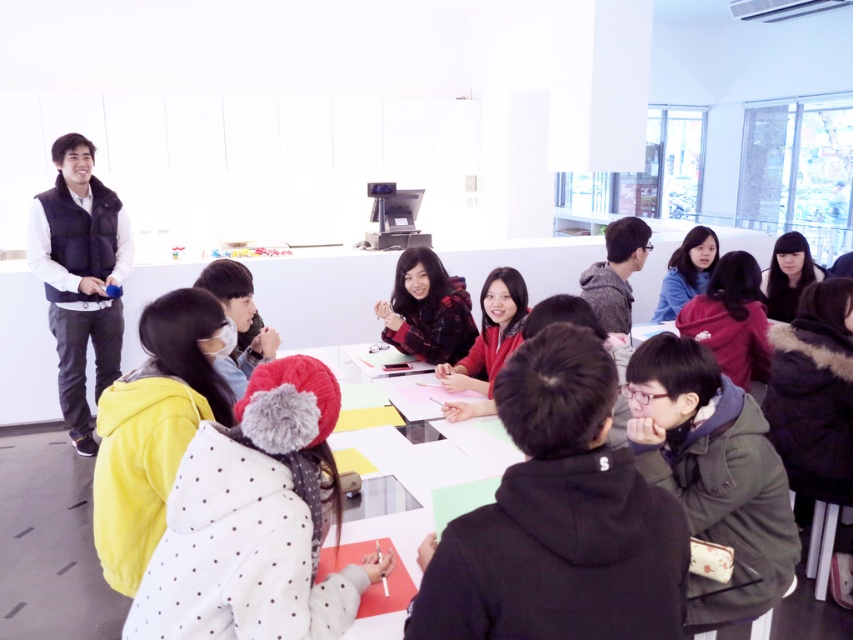
Question: Can you confirm if matte red jacket at center is smaller than black matte hair at center?

Choices:
 (A) yes
 (B) no

Answer: (A)

Question: Can you confirm if white polka dot jacket at center is thinner than yellow fleece jacket at lower left?

Choices:
 (A) no
 (B) yes

Answer: (A)

Question: Can you confirm if yellow fleece jacket at lower left is positioned to the left of red plaid shirt at center?

Choices:
 (A) yes
 (B) no

Answer: (A)

Question: Which object appears farthest from the camera in this image?

Choices:
 (A) red plaid shirt at center
 (B) gray hoodie at center
 (C) black matte hair at center

Answer: (C)

Question: Considering the real-world distances, which object is farthest from the matte red jacket at center?

Choices:
 (A) matte black hoodie at center
 (B) yellow fleece jacket at lower left
 (C) black matte hair at center

Answer: (B)

Question: Which point is farther to the camera?

Choices:
 (A) black matte hair at center
 (B) white polka dot jacket at center
 (C) yellow fleece jacket at lower left
 (D) gray hoodie at center

Answer: (A)